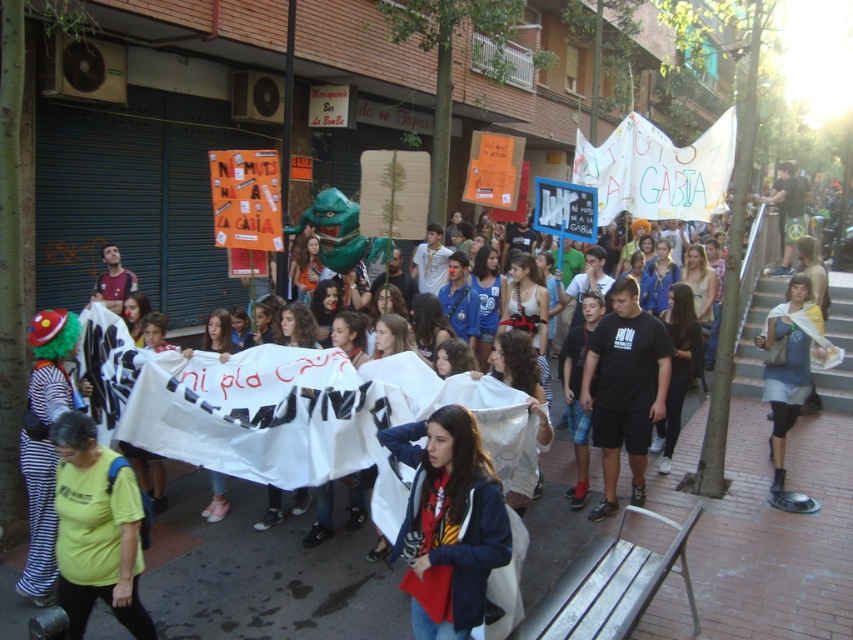
Does dark blue jacket at center have a smaller size compared to black cotton t-shirt at center?

Yes.

Who is more forward, (465, 515) or (589, 371)?

Point (465, 515) is in front.

Identify the location of dark blue jacket at center. (448, 522).

You are a GUI agent. You are given a task and a screenshot of the screen. Output one action in this format:
    pyautogui.click(x=<x>, y=<y>)
    Task: Click on the white fabric banner at center
    
    Given the screenshot: What is the action you would take?
    pyautogui.click(x=262, y=573)

The height and width of the screenshot is (640, 853). Describe the element at coordinates (262, 573) in the screenshot. I see `white fabric banner at center` at that location.

The image size is (853, 640). What are the coordinates of `white fabric banner at center` in the screenshot? It's located at (262, 573).

Does dark blue jacket at center lie behind denim skirt at center?

That is False.

Who is positioned more to the right, dark blue jacket at center or denim skirt at center?

From the viewer's perspective, denim skirt at center appears more on the right side.

Is point (409, 422) closer to viewer compared to point (762, 346)?

Yes, it is.

At what (x,y) coordinates should I click in order to perform the action: click on dark blue jacket at center. Please return your answer as a coordinate pair (x, y). Looking at the image, I should click on click(448, 522).